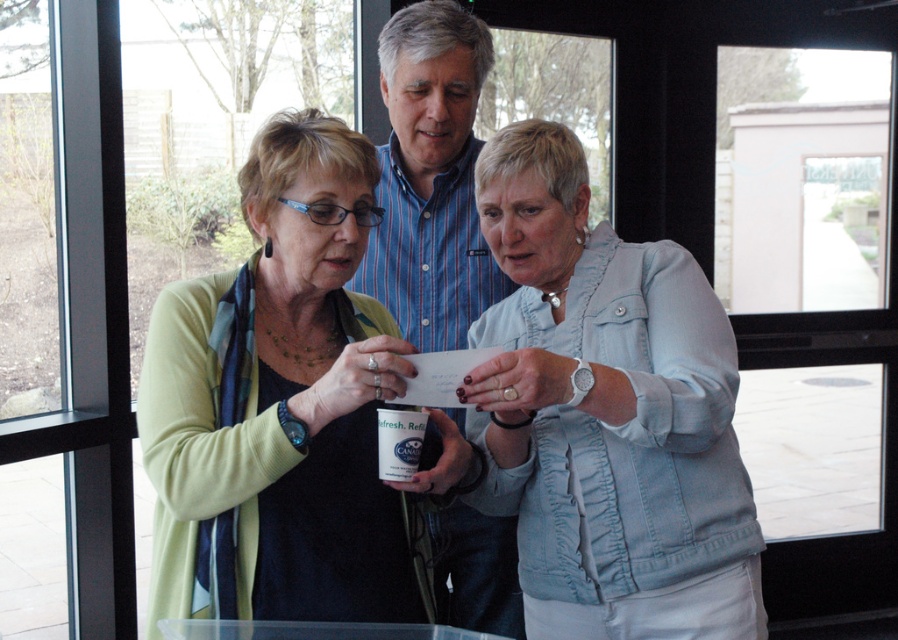
Based on the photo, who is positioned more to the left, light blue denim jacket at center or matte green cardigan at center?

matte green cardigan at center is more to the left.

Consider the image. Does light blue denim jacket at center appear under matte green cardigan at center?

Yes, light blue denim jacket at center is below matte green cardigan at center.

The width and height of the screenshot is (898, 640). What do you see at coordinates (606, 413) in the screenshot?
I see `light blue denim jacket at center` at bounding box center [606, 413].

Where is `light blue denim jacket at center`? The height and width of the screenshot is (640, 898). light blue denim jacket at center is located at coordinates (606, 413).

Between white glossy mug at center and blue striped shirt at center, which one is positioned lower?

white glossy mug at center is below.

How distant is white glossy mug at center from blue striped shirt at center?

white glossy mug at center and blue striped shirt at center are 17.73 inches apart from each other.

Is point (621, 474) positioned after point (489, 547)?

No, (621, 474) is closer to viewer.

Locate an element on the screen. The width and height of the screenshot is (898, 640). white glossy mug at center is located at coordinates (486, 428).

Find the location of a particular element. The height and width of the screenshot is (640, 898). white glossy mug at center is located at coordinates (486, 428).

Who is taller, white glossy mug at center or light blue denim jacket at center?

Standing taller between the two is light blue denim jacket at center.

Does point (650, 557) come closer to viewer compared to point (503, 179)?

Yes, point (650, 557) is closer to viewer.

Locate an element on the screen. The height and width of the screenshot is (640, 898). white glossy mug at center is located at coordinates (486, 428).